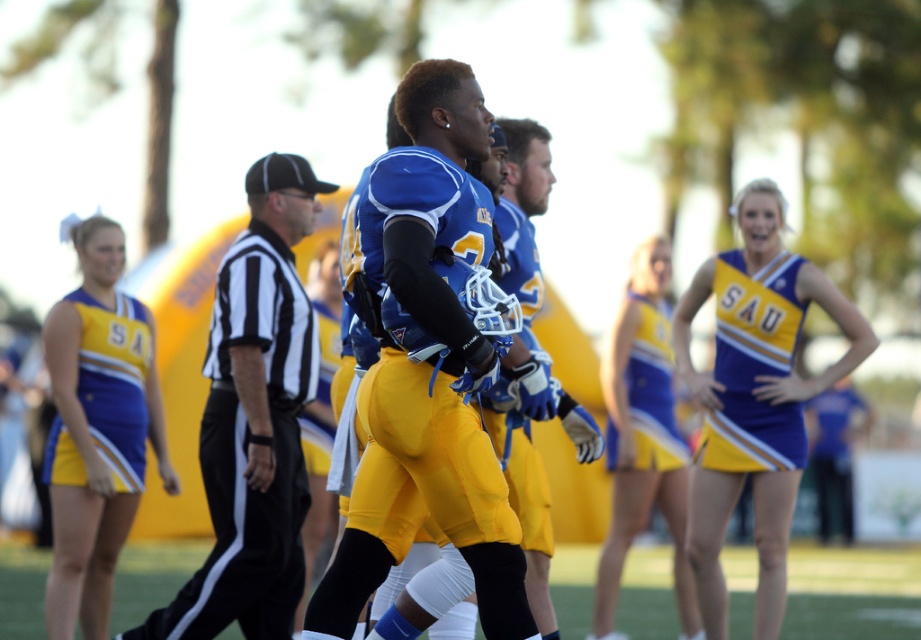
Question: Can you confirm if black and white striped shirt at center is thinner than yellow shiny fabric cheerleading outfit at center?

Choices:
 (A) no
 (B) yes

Answer: (A)

Question: Which point is farther to the camera?

Choices:
 (A) yellow shiny fabric cheerleading outfit at center
 (B) black and white striped shirt at center
 (C) matte yellow cheerleading outfit at left

Answer: (A)

Question: Which of these objects is positioned closest to the matte blue jersey at center?

Choices:
 (A) yellow shiny fabric cheerleading outfit at center
 (B) matte yellow cheerleading outfit at left
 (C) yellow satin skirt at right

Answer: (B)

Question: Does black and white striped shirt at center appear under yellow satin skirt at right?

Choices:
 (A) no
 (B) yes

Answer: (B)

Question: Which is nearer to the black and white striped shirt at center?

Choices:
 (A) matte yellow cheerleading outfit at left
 (B) yellow satin skirt at right

Answer: (A)

Question: Is matte blue jersey at center smaller than matte yellow cheerleading outfit at left?

Choices:
 (A) yes
 (B) no

Answer: (B)